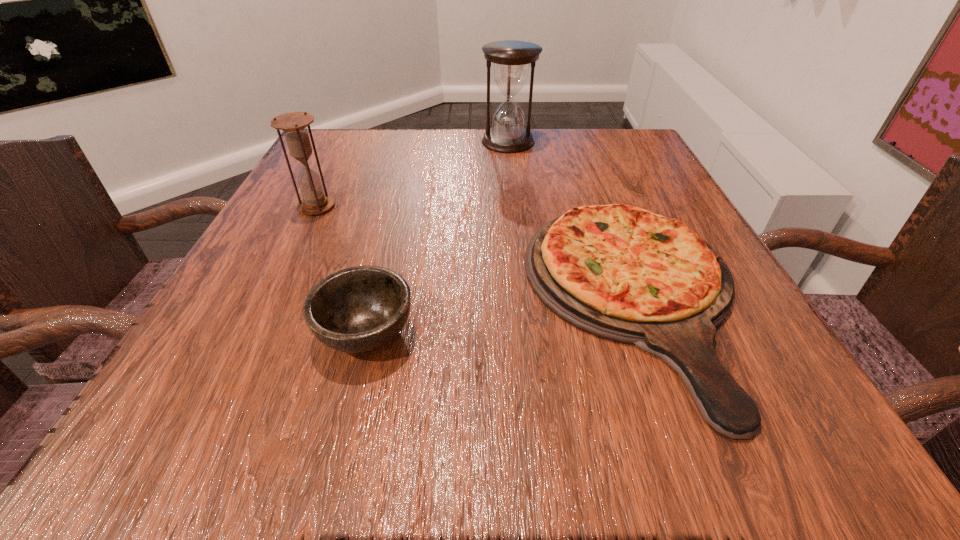
Identify the location of vacant space at the near left corner. The height and width of the screenshot is (540, 960). (265, 454).

At what (x,y) coordinates should I click in order to perform the action: click on vacant space at the far right corner of the desktop. Please return your answer as a coordinate pair (x, y). Image resolution: width=960 pixels, height=540 pixels. Looking at the image, I should click on (650, 167).

In the image, there is a desktop. Identify the location of vacant space at the near right corner. This screenshot has width=960, height=540. (756, 401).

At what (x,y) coordinates should I click in order to perform the action: click on free spot between the second shortest object and the farthest object. Please return your answer as a coordinate pair (x, y). Image resolution: width=960 pixels, height=540 pixels. Looking at the image, I should click on (437, 237).

This screenshot has width=960, height=540. I want to click on vacant space in between the shortest object and the leftmost object, so click(x=476, y=253).

This screenshot has width=960, height=540. I want to click on free point between the tallest object and the second object from left to right, so click(437, 237).

Locate an element on the screen. This screenshot has width=960, height=540. unoccupied area between the nearer hourglass and the farther hourglass is located at coordinates (412, 174).

Image resolution: width=960 pixels, height=540 pixels. In order to click on free space between the second object from left to right and the shortest object in this screenshot , I will do `click(500, 315)`.

I want to click on vacant region between the second tallest object and the second shortest object, so click(341, 269).

Locate an element on the screen. The width and height of the screenshot is (960, 540). vacant space in between the shortest object and the third object from right to left is located at coordinates (500, 315).